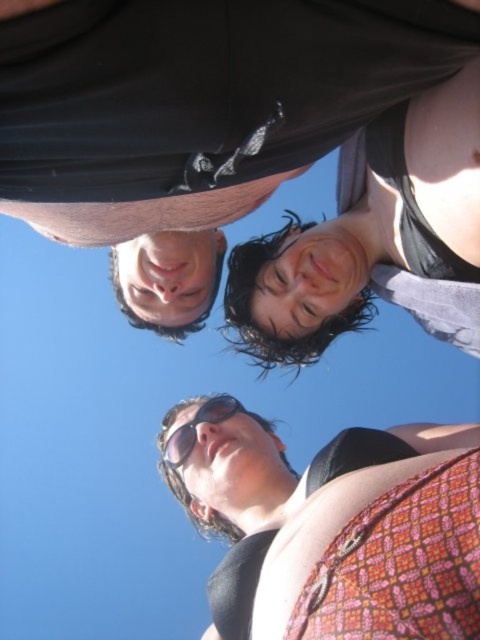
Locate an element on the screen. Image resolution: width=480 pixels, height=640 pixels. black matte shirt at upper center is located at coordinates click(x=256, y=147).

Which of these two, black matte shirt at upper center or patterned fabric top at lower center, stands taller?

black matte shirt at upper center

Locate an element on the screen. The height and width of the screenshot is (640, 480). black matte shirt at upper center is located at coordinates (256, 147).

Is black matte shirt at upper center closer to the viewer compared to black reflective sunglasses at center?

That is True.

Which of these two, black matte shirt at upper center or black reflective sunglasses at center, stands shorter?

With less height is black reflective sunglasses at center.

What do you see at coordinates (256, 147) in the screenshot? The height and width of the screenshot is (640, 480). I see `black matte shirt at upper center` at bounding box center [256, 147].

Identify the location of black matte shirt at upper center. (256, 147).

Is patterned fabric top at lower center smaller than black reflective sunglasses at center?

Actually, patterned fabric top at lower center might be larger than black reflective sunglasses at center.

At what (x,y) coordinates should I click in order to perform the action: click on patterned fabric top at lower center. Please return your answer as a coordinate pair (x, y). The height and width of the screenshot is (640, 480). Looking at the image, I should click on (260, 484).

At what (x,y) coordinates should I click in order to perform the action: click on patterned fabric top at lower center. Please return your answer as a coordinate pair (x, y). The width and height of the screenshot is (480, 640). Looking at the image, I should click on [260, 484].